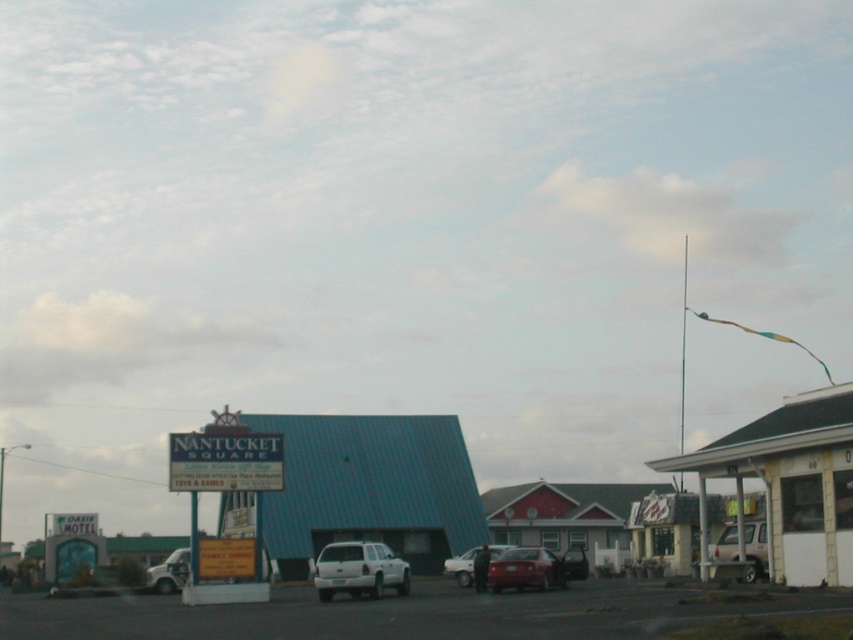
Between silver metallic van at center and matte white truck at center, which one has less height?

With less height is silver metallic van at center.

Which is more to the right, silver metallic van at center or matte white truck at center?

From the viewer's perspective, silver metallic van at center appears more on the right side.

Locate an element on the screen. Image resolution: width=853 pixels, height=640 pixels. silver metallic van at center is located at coordinates (755, 548).

Which is more to the right, blue corrugated metal motel at center or blue plastic sign at center?

blue corrugated metal motel at center is more to the right.

Between point (358, 468) and point (202, 483), which one is positioned behind?

Point (358, 468)

This screenshot has height=640, width=853. I want to click on blue corrugated metal motel at center, so click(364, 486).

Can you confirm if blue plastic sign at center is positioned to the right of white matte truck at lower left?

Indeed, blue plastic sign at center is positioned on the right side of white matte truck at lower left.

Does blue plastic sign at center have a lesser height compared to white matte truck at lower left?

Yes, blue plastic sign at center is shorter than white matte truck at lower left.

Locate an element on the screen. This screenshot has width=853, height=640. blue plastic sign at center is located at coordinates (225, 461).